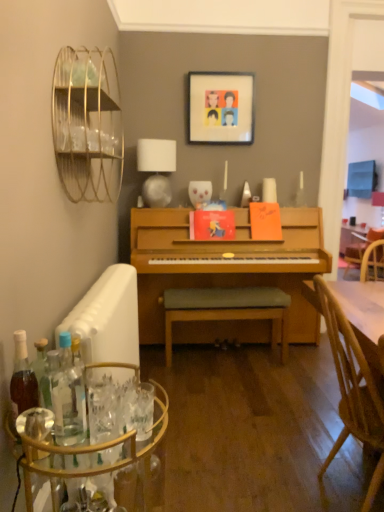
Where is `vacant region under gold wire birdcage at left (from a real-world perspective)`? vacant region under gold wire birdcage at left (from a real-world perspective) is located at coordinates (109, 284).